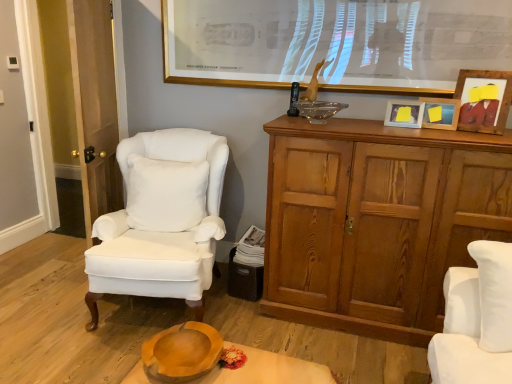
You are a GUI agent. You are given a task and a screenshot of the screen. Output one action in this format:
    pyautogui.click(x=<x>, y=<y>)
    Task: Click on the vacant space in front of black plastic remote control at upper center
    The width and height of the screenshot is (512, 384).
    Given the screenshot: What is the action you would take?
    pyautogui.click(x=305, y=112)